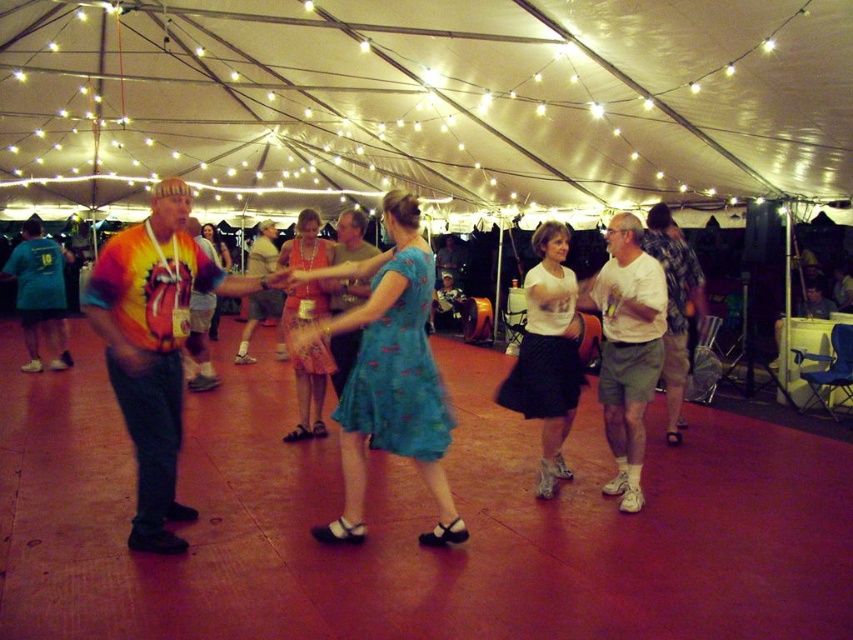
Does rainbow tie-dye shirt at left appear over matte tie-dye shirt at center?

Actually, rainbow tie-dye shirt at left is below matte tie-dye shirt at center.

Does rainbow tie-dye shirt at left have a greater width compared to matte tie-dye shirt at center?

Indeed, rainbow tie-dye shirt at left has a greater width compared to matte tie-dye shirt at center.

This screenshot has width=853, height=640. Find the location of `rainbow tie-dye shirt at left`. rainbow tie-dye shirt at left is located at coordinates (154, 346).

In order to click on rainbow tie-dye shirt at left in this screenshot , I will do `click(154, 346)`.

Is point (408, 336) closer to viewer compared to point (621, 243)?

Yes, point (408, 336) is in front of point (621, 243).

Does teal floral dress at center appear under white cotton shirt at center?

No.

Is point (376, 323) less distant than point (624, 390)?

Yes, point (376, 323) is closer to viewer.

The width and height of the screenshot is (853, 640). Find the location of `teal floral dress at center`. teal floral dress at center is located at coordinates (398, 371).

Between point (149, 476) and point (28, 342), which one is positioned in front?

Point (149, 476) is more forward.

The width and height of the screenshot is (853, 640). Describe the element at coordinates (154, 346) in the screenshot. I see `rainbow tie-dye shirt at left` at that location.

The height and width of the screenshot is (640, 853). Identify the location of rainbow tie-dye shirt at left. (154, 346).